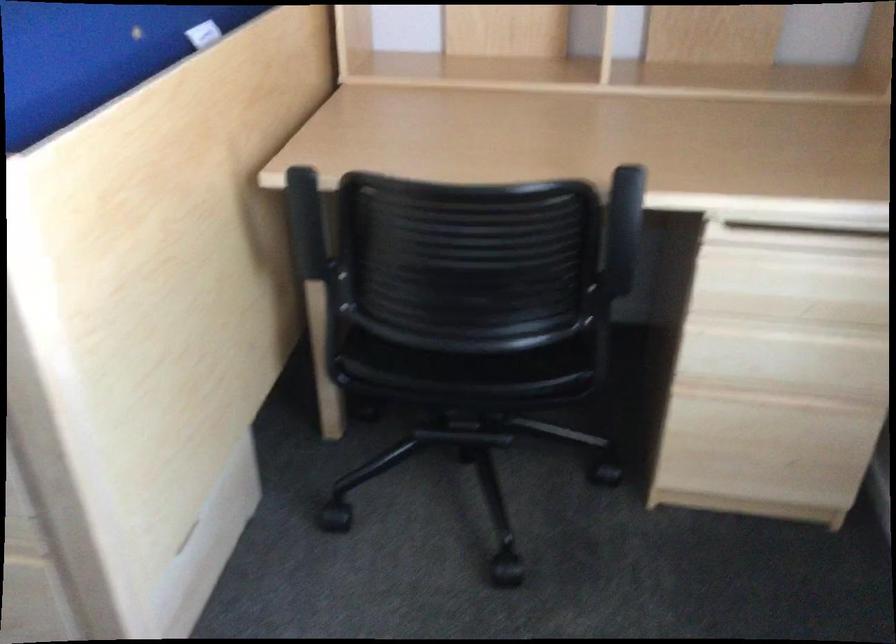
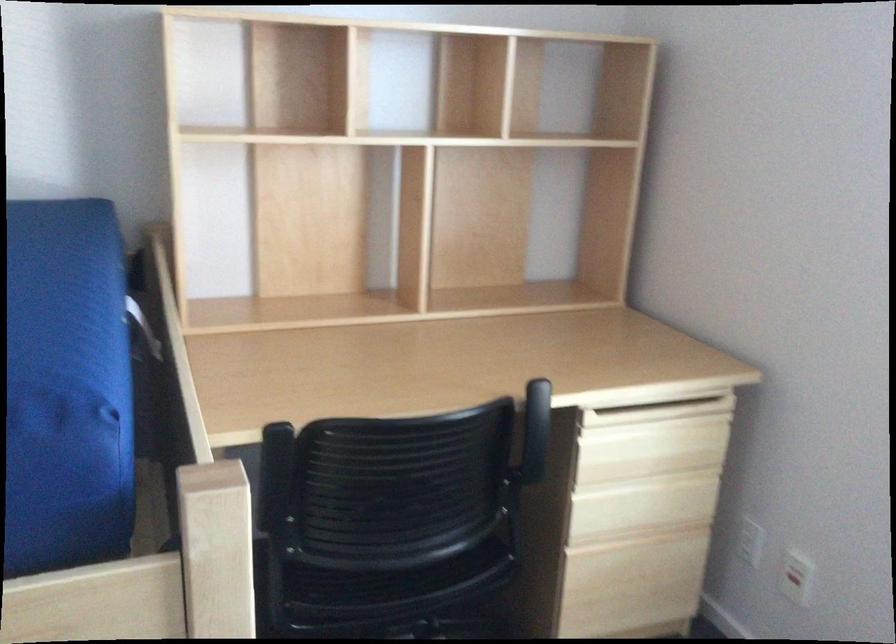
The point at (780, 359) is marked in the first image. Where is the corresponding point in the second image?

(642, 506)